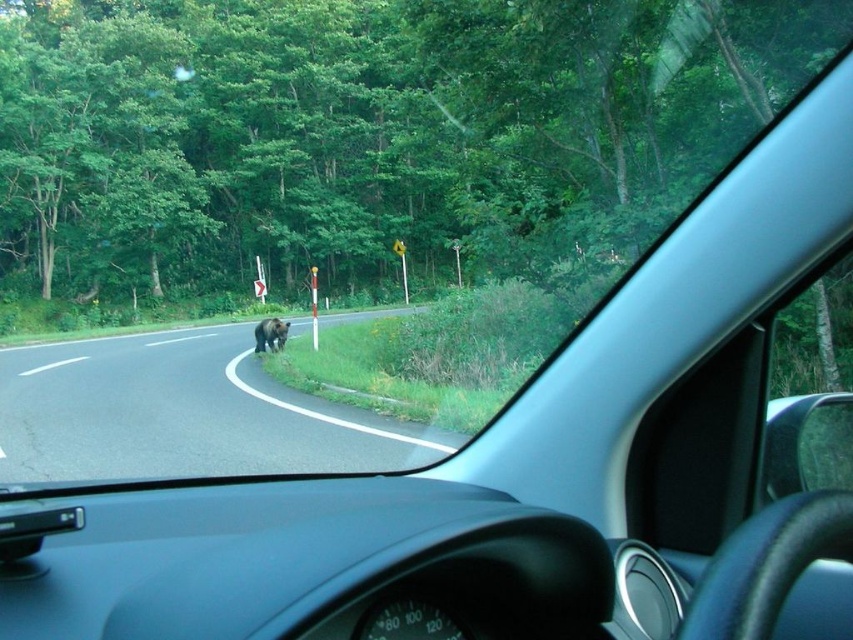
Question: Is dark asphalt road at center further to camera compared to brown furry bear at center?

Choices:
 (A) no
 (B) yes

Answer: (A)

Question: Is dark asphalt road at center to the right of brown furry bear at center from the viewer's perspective?

Choices:
 (A) yes
 (B) no

Answer: (B)

Question: Which point is farther from the camera taking this photo?

Choices:
 (A) (99, 352)
 (B) (271, 324)

Answer: (A)

Question: Which point appears farthest from the camera in this image?

Choices:
 (A) (256, 352)
 (B) (244, 356)

Answer: (A)

Question: Is dark asphalt road at center to the left of brown furry bear at center from the viewer's perspective?

Choices:
 (A) no
 (B) yes

Answer: (B)